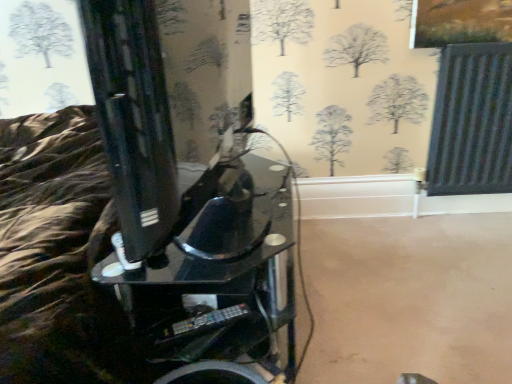
The height and width of the screenshot is (384, 512). I want to click on black glass coffee table at center, so click(211, 270).

The width and height of the screenshot is (512, 384). Describe the element at coordinates (211, 270) in the screenshot. I see `black glass coffee table at center` at that location.

At what (x,y) coordinates should I click in order to perform the action: click on black glass coffee table at center. Please return your answer as a coordinate pair (x, y). Looking at the image, I should click on (211, 270).